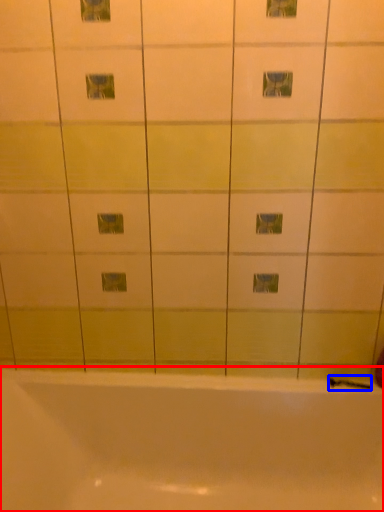
Question: Which object appears closest to the camera in this image, bathtub (highlighted by a red box) or shower (highlighted by a blue box)?

Choices:
 (A) bathtub
 (B) shower

Answer: (A)